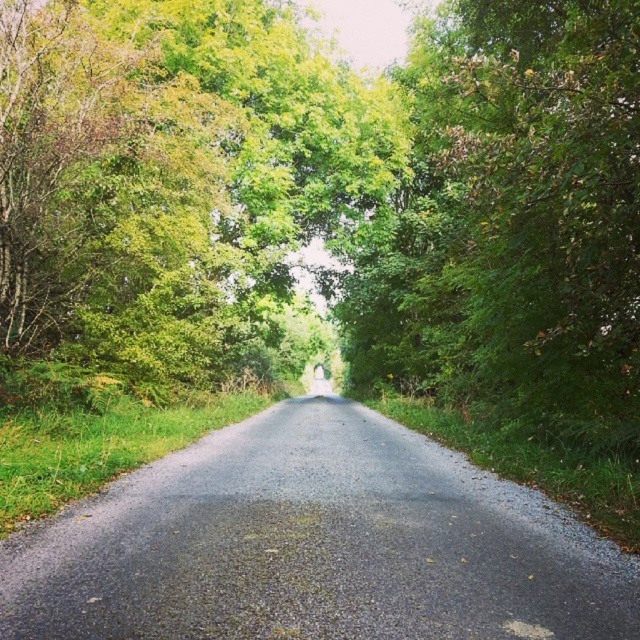
You are standing at the point labeled point (328, 192) on the rural road. Looking around, you see a green leafy tree at center. Which direction should you walk to reach the tree?

The point (328, 192) is on the green leafy tree at center, so you are already at the tree. No need to walk further.

You are standing at the point labeled point (8,52) on a rural road surrounded by greenery. You want to walk straight ahead for 10 meters. Will you still be on the road after walking?

Since you are 15.41 meters away from the point labeled point (8,52), walking 10 meters straight ahead would leave you 5.41 meters away from the point, still on the road as there is no indication of the road ending within that distance according to the scene description.